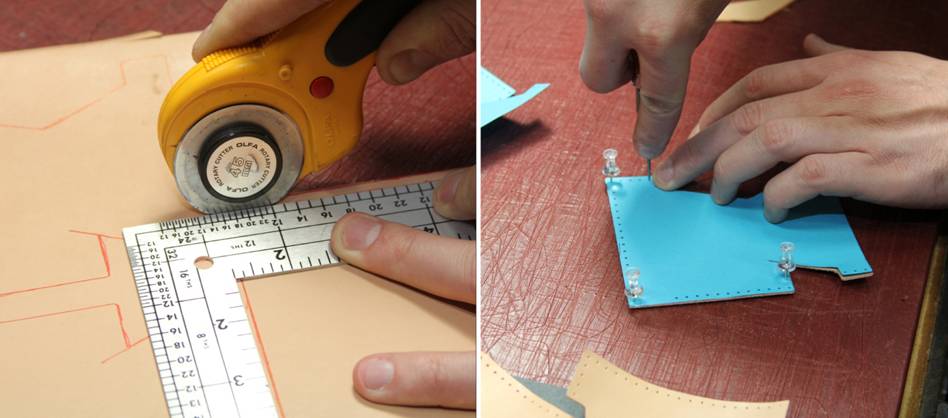
At what (x,y) coordinates should I click in order to perform the action: click on thumb tacks. Please return your answer as a coordinate pair (x, y). This screenshot has width=948, height=418. Looking at the image, I should click on (609, 158), (631, 284), (785, 263).